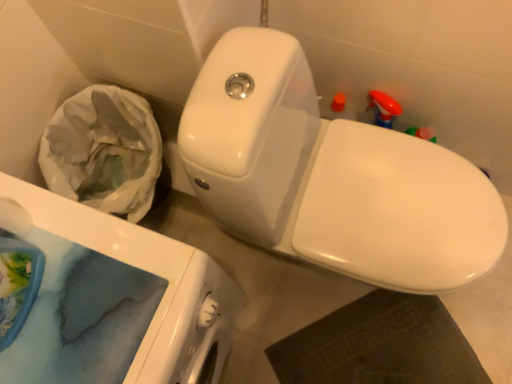
At what (x,y) coordinates should I click in order to perform the action: click on free space in front of white matte toilet paper at lower left. Please return your answer as a coordinate pair (x, y). Looking at the image, I should click on (69, 309).